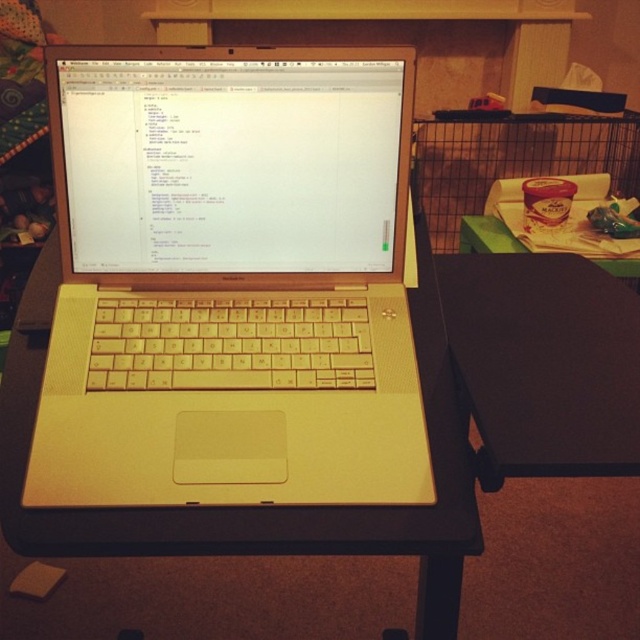
You are organizing a workspace and need to place a new monitor between the black matte table at center and the green matte table at right. According to the scene, which table should the monitor be placed closer to?

The black matte table at center is to the left of the green matte table at right. Since the monitor needs to be placed between them, it should be positioned closer to the black matte table at center to maintain symmetry or centered alignment in the workspace setup.

From the picture: You are setting up a new workspace and want to ensure that the white matte laptop at center will fit on the black matte table at center. Based on their sizes, can you confirm if the laptop will fit on the table?

The white matte laptop at center is larger in width than the black matte table at center, so the laptop will not fit on the table.

You are trying to locate a specific point in the workspace. The point is at coordinates point (228, 282). Based on the scene description, where is this point located?

The point (228, 282) is located on the white matte laptop at center.